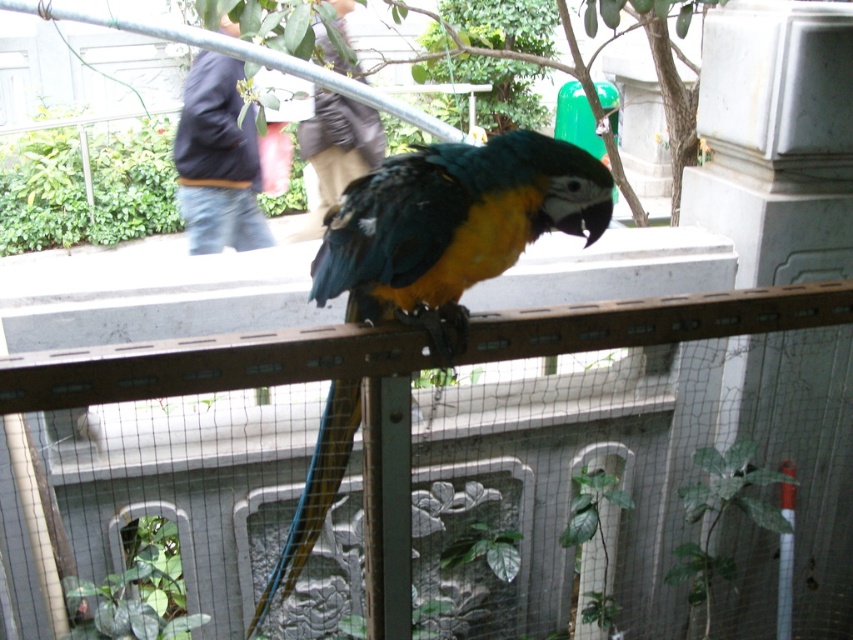
You are a zookeeper trying to clean the enclosure. The metal mesh fence at center and the shiny multicolored parrot at center are in your way. Which object should you move first if you need to clear the area with the least effort?

The metal mesh fence at center occupies less space than the shiny multicolored parrot at center, so you should move the metal mesh fence at center first to clear the area with the least effort.

You are standing in front of the parrot enclosure and want to take a photo of the parrot. The camera you are using has a focus range of 1.5 meters. Is the point where the parrot is perched, point (555, 308), within the camera focus range?

The distance of point (555, 308) from the camera is 1.42 meters, which is within the camera focus range of 1.5 meters. Therefore, the camera can focus on the parrot at that point.

You are a zookeeper trying to feed the shiny multicolored parrot at center. You have a small treat in your hand. The parrot is currently on the metal mesh fence at center. To reach the parrot, you need to move to its left or right side. Based on the enclosure layout, which side should you approach from to ensure you are on the same side as the parrot?

You should approach from the right side because the metal mesh fence at center is to the right of the shiny multicolored parrot at center, meaning the parrot is on the left side of the fence. Therefore, moving to the right of the fence would place you on the same side as the parrot.